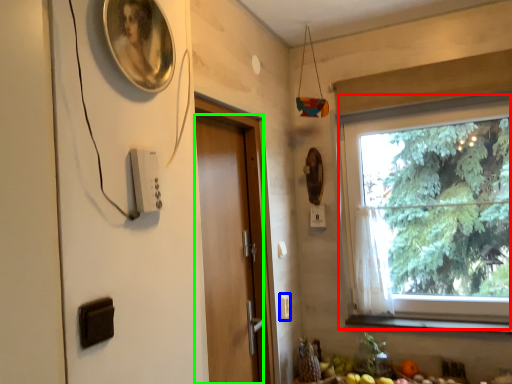
Question: Considering the real-world distances, which object is closest to window (highlighted by a red box)? light switch (highlighted by a blue box) or door (highlighted by a green box).

Choices:
 (A) light switch
 (B) door

Answer: (B)